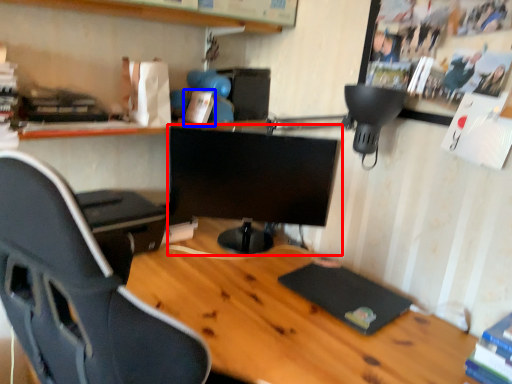
Question: Which of the following is the closest to the observer, computer monitor (highlighted by a red box) or book (highlighted by a blue box)?

Choices:
 (A) computer monitor
 (B) book

Answer: (A)